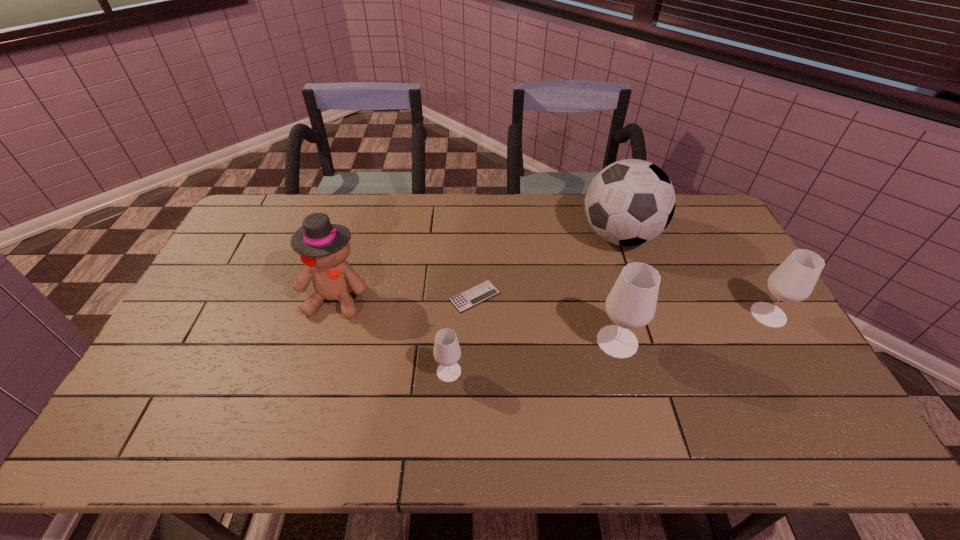
Find the location of a particular element. The height and width of the screenshot is (540, 960). free space located 0.080m on the back of the rightmost glass is located at coordinates (750, 282).

What are the coordinates of `free space located on the front-facing side of the rag_doll` in the screenshot? It's located at (312, 379).

Image resolution: width=960 pixels, height=540 pixels. I want to click on vacant space located on the main logo of the farthest object, so click(x=521, y=236).

You are a GUI agent. You are given a task and a screenshot of the screen. Output one action in this format:
    pyautogui.click(x=<x>, y=<y>)
    Task: Click on the vacant space located 0.280m on the main logo of the farthest object
    The height and width of the screenshot is (540, 960).
    Given the screenshot: What is the action you would take?
    pyautogui.click(x=498, y=236)

Where is `free location located 0.290m on the main logo of the farthest object`? This screenshot has height=540, width=960. free location located 0.290m on the main logo of the farthest object is located at coordinates (495, 236).

The image size is (960, 540). I want to click on free space located on the left of the calculator, so click(327, 296).

Locate an element on the screen. object situated at the far edge is located at coordinates (630, 202).

Find the location of a particular element. object present at the near edge is located at coordinates (447, 352).

The image size is (960, 540). I want to click on object at the right edge, so click(793, 281).

Where is `free space at the far edge of the desktop`? free space at the far edge of the desktop is located at coordinates tap(463, 227).